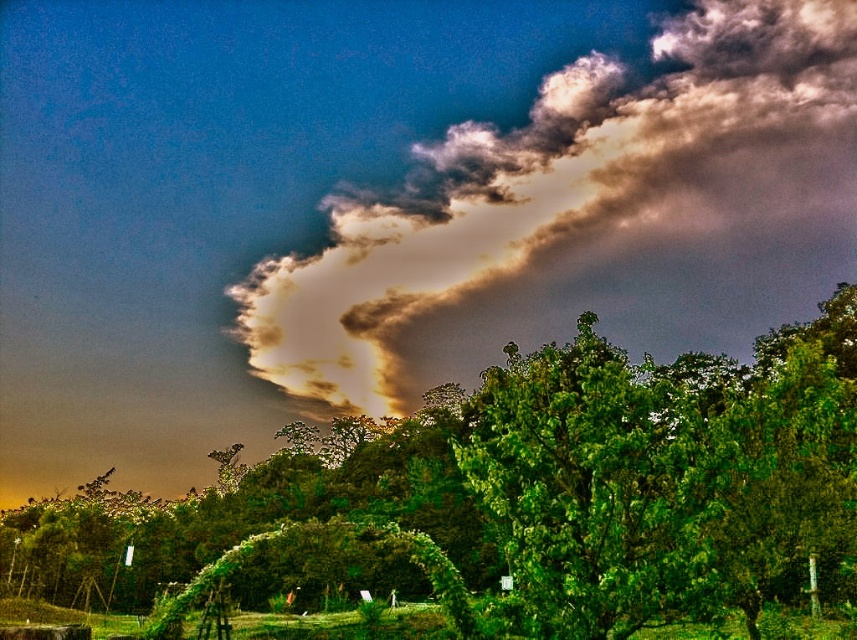
Question: Can you confirm if green leafy tree at center is smaller than cloudy textured sky at upper center?

Choices:
 (A) no
 (B) yes

Answer: (A)

Question: Which object appears closest to the camera in this image?

Choices:
 (A) green leafy tree at center
 (B) cloudy textured sky at upper center

Answer: (A)

Question: Does green leafy tree at center have a smaller size compared to cloudy textured sky at upper center?

Choices:
 (A) no
 (B) yes

Answer: (A)

Question: Can you confirm if green leafy tree at center is thinner than cloudy textured sky at upper center?

Choices:
 (A) yes
 (B) no

Answer: (A)

Question: Which point appears closest to the camera in this image?

Choices:
 (A) (790, 24)
 (B) (10, 557)

Answer: (B)